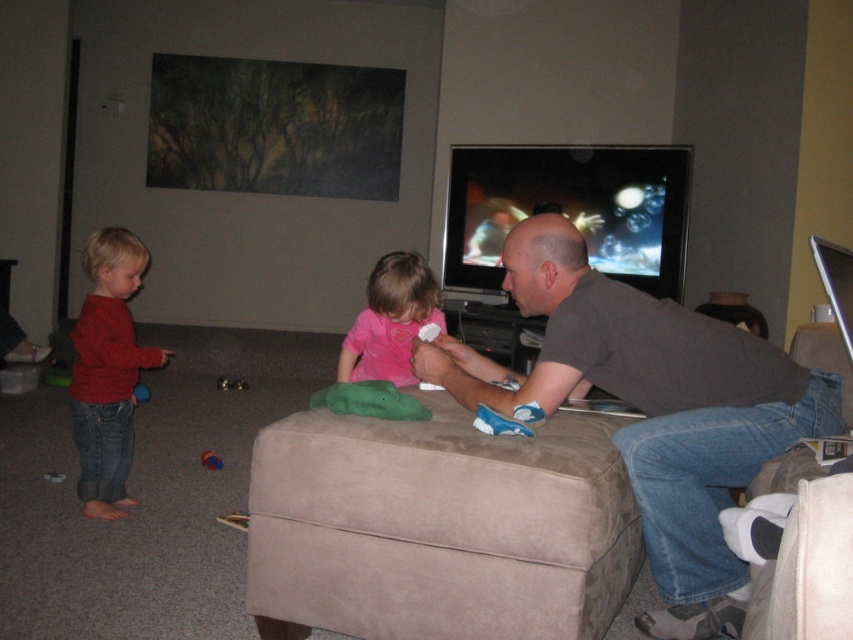
Based on the photo, who is shorter, matte red sweater at left or rubberized red ball at lower left?

With less height is rubberized red ball at lower left.

Is point (86, 362) more distant than point (213, 465)?

No, (86, 362) is closer to viewer.

The width and height of the screenshot is (853, 640). Find the location of `matte red sweater at left`. matte red sweater at left is located at coordinates 107,371.

Is point (82, 348) less distant than point (401, 333)?

Yes, point (82, 348) is closer to viewer.

Between matte red sweater at left and pink matte shirt at center, which one has less height?

Standing shorter between the two is pink matte shirt at center.

Between point (85, 492) and point (378, 352), which one is positioned behind?

Positioned behind is point (378, 352).

Image resolution: width=853 pixels, height=640 pixels. Identify the location of matte red sweater at left. (107, 371).

Between dark gray shirt at center and rubberized red ball at lower left, which one is positioned higher?

dark gray shirt at center is higher up.

Does dark gray shirt at center have a larger size compared to rubberized red ball at lower left?

Yes.

Image resolution: width=853 pixels, height=640 pixels. What are the coordinates of `dark gray shirt at center` in the screenshot? It's located at (650, 408).

I want to click on dark gray shirt at center, so coord(650,408).